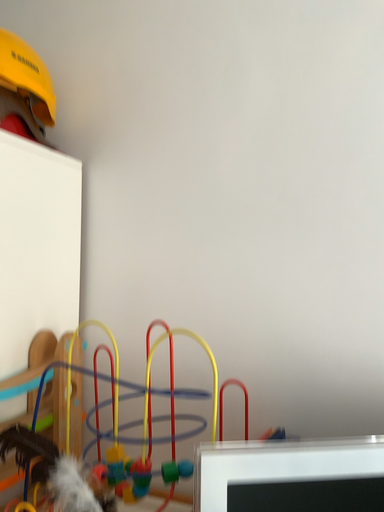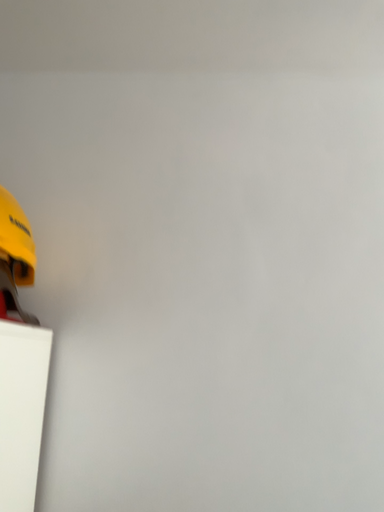
Question: Which way did the camera rotate in the video?

Choices:
 (A) rotated right
 (B) rotated left

Answer: (A)